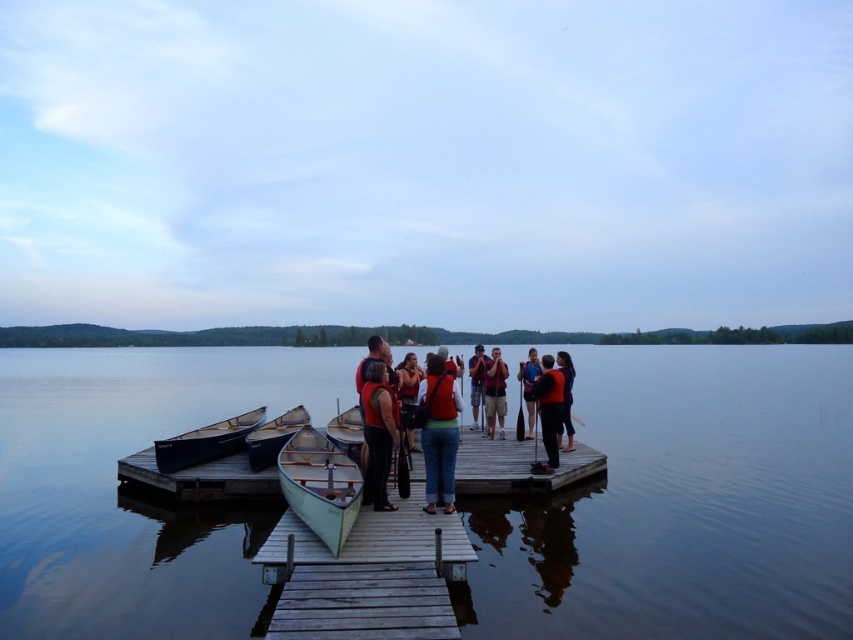
You are standing at the point with coordinates point [518,467] in the scene. Based on the scene description, what object are you most likely standing on?

The point [518,467] corresponds to the wooden dock at center.

You are planning to store the matte orange life vest at center and the light green wood canoe at center on a narrow shelf. Considering their widths, which object might not fit if the shelf has limited space?

The matte orange life vest at center might not fit on the shelf because its width surpasses that of the light green wood canoe at center, making it wider and thus requiring more space.

You are a photographer trying to capture a candid shot of the person wearing the matte black jacket at right. You are holding the matte black camera at center. Since you don not want to disturb the subject, you decide to take the photo from a distance. Will the camera be positioned above or below the jacket in the photo?

The matte black camera at center is above the matte black jacket at right, so in the photo, the camera will be positioned above the jacket.